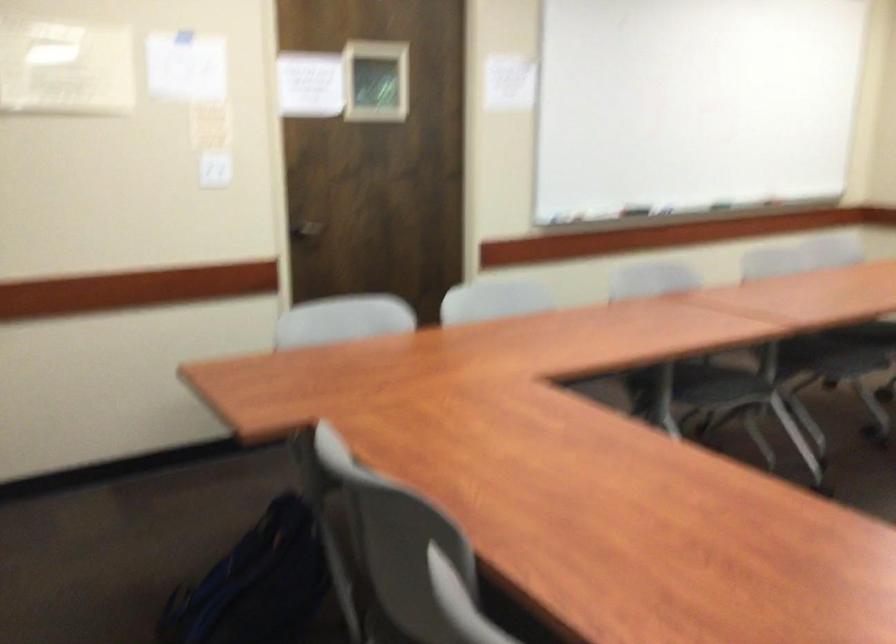
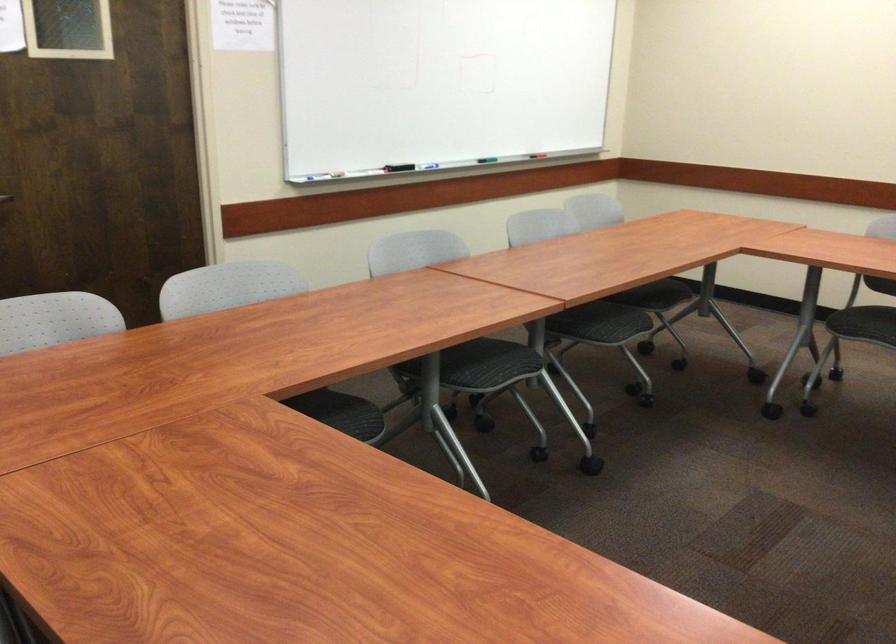
Locate, in the second image, the point that corresponds to point (686, 128) in the first image.

(438, 82)